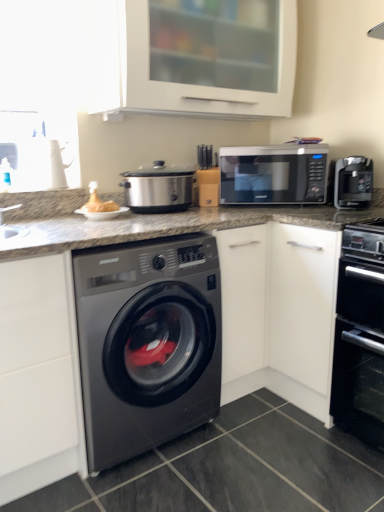
Question: Can you see black matte oven at lower right touching sleek black coffee maker at right?

Choices:
 (A) no
 (B) yes

Answer: (A)

Question: Is black matte oven at lower right smaller than sleek black coffee maker at right?

Choices:
 (A) yes
 (B) no

Answer: (B)

Question: Is black matte oven at lower right further to camera compared to sleek black coffee maker at right?

Choices:
 (A) yes
 (B) no

Answer: (B)

Question: Could you tell me if black matte oven at lower right is facing sleek black coffee maker at right?

Choices:
 (A) yes
 (B) no

Answer: (B)

Question: Is black matte oven at lower right closer to camera compared to sleek black coffee maker at right?

Choices:
 (A) yes
 (B) no

Answer: (A)

Question: Does point (286, 200) appear closer or farther from the camera than point (354, 197)?

Choices:
 (A) farther
 (B) closer

Answer: (A)

Question: From the image's perspective, is black matte microwave at upper right positioned above or below sleek black coffee maker at right?

Choices:
 (A) below
 (B) above

Answer: (B)

Question: From a real-world perspective, relative to sleek black coffee maker at right, is black matte microwave at upper right vertically above or below?

Choices:
 (A) below
 (B) above

Answer: (B)

Question: Looking at their shapes, would you say black matte microwave at upper right is wider or thinner than sleek black coffee maker at right?

Choices:
 (A) thin
 (B) wide

Answer: (B)

Question: Which is correct: satin black washing machine at center is inside matte brown bread at upper left, or outside of it?

Choices:
 (A) inside
 (B) outside

Answer: (B)

Question: Considering their positions, is satin black washing machine at center located in front of or behind matte brown bread at upper left?

Choices:
 (A) front
 (B) behind

Answer: (A)

Question: Looking at the image, does satin black washing machine at center seem bigger or smaller compared to matte brown bread at upper left?

Choices:
 (A) small
 (B) big

Answer: (B)

Question: In terms of height, does satin black washing machine at center look taller or shorter compared to matte brown bread at upper left?

Choices:
 (A) tall
 (B) short

Answer: (A)

Question: Based on their sizes in the image, would you say satin silver slow cooker at center is bigger or smaller than black matte microwave at upper right?

Choices:
 (A) small
 (B) big

Answer: (A)

Question: Considering their positions, is satin silver slow cooker at center located in front of or behind black matte microwave at upper right?

Choices:
 (A) front
 (B) behind

Answer: (A)